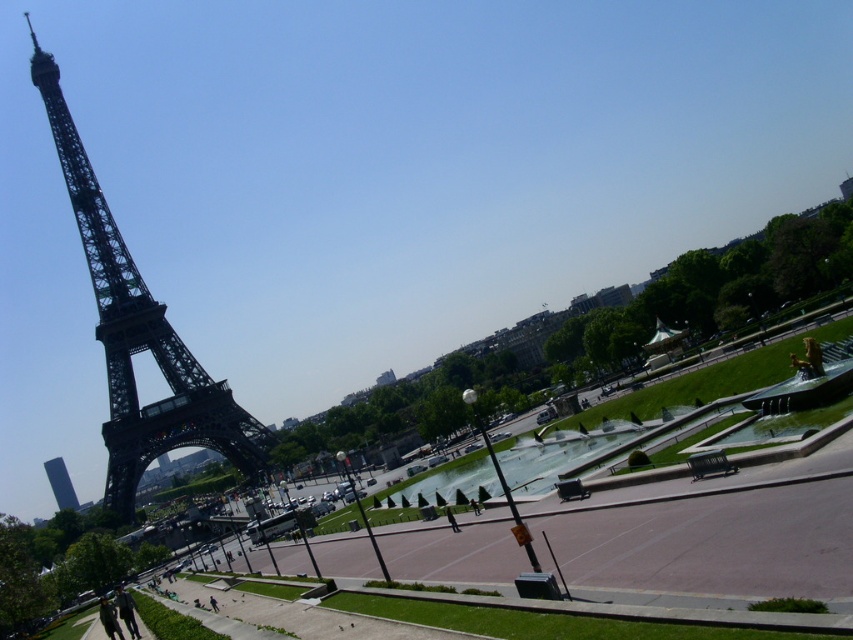
Does smooth glass tower at left have a larger size compared to dark blue jeans at lower left?

Yes.

Is point (74, 500) in front of point (115, 600)?

No, it is behind (115, 600).

The height and width of the screenshot is (640, 853). I want to click on smooth glass tower at left, so click(61, 483).

Who is shorter, black metal eiffel tower at left or dark blue jeans at lower left?

With less height is dark blue jeans at lower left.

Is point (119, 364) positioned in front of point (129, 625)?

No, (119, 364) is further to viewer.

Find the location of `black metal eiffel tower at left`. black metal eiffel tower at left is located at coordinates (138, 337).

Does black metal eiffel tower at left have a lesser width compared to smooth glass tower at left?

No.

Is point (146, 442) positioned in front of point (68, 490)?

Yes, it is.

This screenshot has width=853, height=640. I want to click on black metal eiffel tower at left, so click(x=138, y=337).